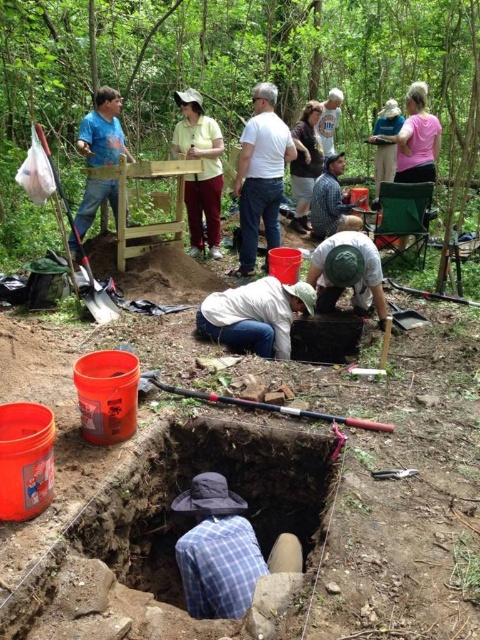
You are a photographer at the archaeological dig site. You want to take a photo that includes both the point at coordinates point (269, 349) and point (397, 140). Which point will appear larger in the photo?

Point (269, 349) will appear larger in the photo because it is closer to the camera than point (397, 140).

Looking at this image, you are a photographer at the archaeological dig site. You want to capture a photo that includes both the checkered fabric shirt at center and the silver metallic shovel at left. Which object should you position closer to the camera to ensure both fit in the frame?

Since the checkered fabric shirt at center occupies less space than the silver metallic shovel at left, you should position the silver metallic shovel at left closer to the camera to ensure both fit in the frame.

You are a photographer at the archaeological dig site. You want to capture a photo that includes both the pink fabric shirt at upper right and the brown cotton shirt at upper center. Given their sizes in the frame, which shirt will appear smaller in the photo?

The pink fabric shirt at upper right occupies less space than the brown cotton shirt at upper center, so it will appear smaller in the photo.